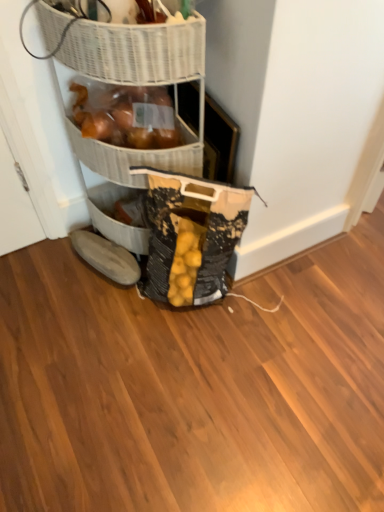
I want to click on brown suede boot at lower left, so click(x=106, y=257).

Identify the location of textured canvas bag at lower center. This screenshot has width=384, height=512. (191, 236).

Does point (92, 22) appear closer or farther from the camera than point (72, 244)?

Point (92, 22) appears to be closer to the viewer than point (72, 244).

Is white wicker basket at upper left, which is counted as the second basket, starting from the back, located outside brown suede boot at lower left?

white wicker basket at upper left, which is counted as the second basket, starting from the back, lies outside brown suede boot at lower left's area.

Is white wicker basket at upper left, which is counted as the second basket, starting from the back, to the left of brown suede boot at lower left from the viewer's perspective?

No, white wicker basket at upper left, which is counted as the second basket, starting from the back, is not to the left of brown suede boot at lower left.

Considering the relative positions of white wicker basket at upper left, which is counted as the second basket, starting from the back, and brown suede boot at lower left in the image provided, is white wicker basket at upper left, which is counted as the second basket, starting from the back, behind brown suede boot at lower left?

No.

Which object is more forward, brown suede boot at lower left or white wicker basket at upper left, marked as the first basket in a front-to-back arrangement?

white wicker basket at upper left, marked as the first basket in a front-to-back arrangement.

Does brown suede boot at lower left have a lesser height compared to white wicker basket at upper left, which is counted as the second basket, starting from the back?

Correct, brown suede boot at lower left is not as tall as white wicker basket at upper left, which is counted as the second basket, starting from the back.

Considering the positions of points (83, 234) and (143, 57), is point (83, 234) farther from camera compared to point (143, 57)?

Yes, it is behind point (143, 57).

From the image's perspective, is brown suede boot at lower left beneath textured canvas bag at lower center?

Yes.

There is a brown suede boot at lower left. Where is `material above it (from a real-world perspective)`? The image size is (384, 512). material above it (from a real-world perspective) is located at coordinates (191, 236).

Can we say brown suede boot at lower left lies outside textured canvas bag at lower center?

Yes, brown suede boot at lower left is outside of textured canvas bag at lower center.

Is textured canvas bag at lower center spatially inside white wicker basket at upper left, which is counted as the second basket, starting from the back, or outside of it?

textured canvas bag at lower center lies outside white wicker basket at upper left, which is counted as the second basket, starting from the back.

Is the position of textured canvas bag at lower center more distant than that of white wicker basket at upper left, which is counted as the second basket, starting from the back?

Yes, textured canvas bag at lower center is further from the viewer.

From the image's perspective, is textured canvas bag at lower center positioned above or below white wicker basket at upper left, marked as the first basket in a front-to-back arrangement?

textured canvas bag at lower center is below white wicker basket at upper left, marked as the first basket in a front-to-back arrangement.

Is textured canvas bag at lower center wider than white wicker basket at upper left, marked as the first basket in a front-to-back arrangement?

No.

Considering the sizes of textured canvas bag at lower center and brown suede boot at lower left in the image, is textured canvas bag at lower center wider or thinner than brown suede boot at lower left?

textured canvas bag at lower center is wider than brown suede boot at lower left.

From a real-world perspective, is textured canvas bag at lower center below brown suede boot at lower left?

No, from a real-world perspective, textured canvas bag at lower center is not below brown suede boot at lower left.

Which is in front, point (175, 191) or point (107, 247)?

The point (175, 191) is in front.

Are textured canvas bag at lower center and brown suede boot at lower left making contact?

There is a gap between textured canvas bag at lower center and brown suede boot at lower left.

Is textured canvas bag at lower center placed right next to woven brown basket at upper center, which ranks as the 2th basket in front-to-back order?

textured canvas bag at lower center and woven brown basket at upper center, which ranks as the 2th basket in front-to-back order, are not in contact.

Which is more to the right, textured canvas bag at lower center or woven brown basket at upper center, acting as the first basket starting from the back?

Positioned to the right is textured canvas bag at lower center.

Is textured canvas bag at lower center facing towards woven brown basket at upper center, acting as the first basket starting from the back?

No.

From the picture: Can you confirm if brown suede boot at lower left is shorter than woven brown basket at upper center, which ranks as the 2th basket in front-to-back order?

Indeed, brown suede boot at lower left has a lesser height compared to woven brown basket at upper center, which ranks as the 2th basket in front-to-back order.

From the image's perspective, which is below, brown suede boot at lower left or woven brown basket at upper center, which ranks as the 2th basket in front-to-back order?

brown suede boot at lower left.

Which object is thinner, brown suede boot at lower left or woven brown basket at upper center, which ranks as the 2th basket in front-to-back order?

brown suede boot at lower left is thinner.

Is brown suede boot at lower left aimed at woven brown basket at upper center, acting as the first basket starting from the back?

No, brown suede boot at lower left is not turned towards woven brown basket at upper center, acting as the first basket starting from the back.

Where is `footwear on the left of the white wicker basket at upper left, marked as the first basket in a front-to-back arrangement`? footwear on the left of the white wicker basket at upper left, marked as the first basket in a front-to-back arrangement is located at coordinates (106, 257).

Where is `footwear located behind the white wicker basket at upper left, marked as the first basket in a front-to-back arrangement`? Image resolution: width=384 pixels, height=512 pixels. footwear located behind the white wicker basket at upper left, marked as the first basket in a front-to-back arrangement is located at coordinates (106, 257).

Which object lies further to the anchor point textured canvas bag at lower center, brown suede boot at lower left or woven brown basket at upper center, acting as the first basket starting from the back?

brown suede boot at lower left is positioned further to the anchor textured canvas bag at lower center.

From the image, which object appears to be farther from brown suede boot at lower left, white wicker basket at upper left, marked as the first basket in a front-to-back arrangement, or woven brown basket at upper center, which ranks as the 2th basket in front-to-back order?

white wicker basket at upper left, marked as the first basket in a front-to-back arrangement, is further to brown suede boot at lower left.

From the picture: Based on their spatial positions, is textured canvas bag at lower center or white wicker basket at upper left, which is counted as the second basket, starting from the back, further from woven brown basket at upper center, acting as the first basket starting from the back?

white wicker basket at upper left, which is counted as the second basket, starting from the back.

Based on their spatial positions, is woven brown basket at upper center, which ranks as the 2th basket in front-to-back order, or brown suede boot at lower left closer to textured canvas bag at lower center?

Among the two, woven brown basket at upper center, which ranks as the 2th basket in front-to-back order, is located nearer to textured canvas bag at lower center.

Based on their spatial positions, is woven brown basket at upper center, which ranks as the 2th basket in front-to-back order, or white wicker basket at upper left, marked as the first basket in a front-to-back arrangement, closer to textured canvas bag at lower center?

woven brown basket at upper center, which ranks as the 2th basket in front-to-back order, is closer to textured canvas bag at lower center.

Which object lies further to the anchor point textured canvas bag at lower center, white wicker basket at upper left, which is counted as the second basket, starting from the back, or woven brown basket at upper center, which ranks as the 2th basket in front-to-back order?

The object further to textured canvas bag at lower center is white wicker basket at upper left, which is counted as the second basket, starting from the back.

From the image, which object appears to be farther from white wicker basket at upper left, marked as the first basket in a front-to-back arrangement, textured canvas bag at lower center or woven brown basket at upper center, acting as the first basket starting from the back?

The object further to white wicker basket at upper left, marked as the first basket in a front-to-back arrangement, is textured canvas bag at lower center.

Based on their spatial positions, is woven brown basket at upper center, acting as the first basket starting from the back, or textured canvas bag at lower center further from white wicker basket at upper left, which is counted as the second basket, starting from the back?

The object further to white wicker basket at upper left, which is counted as the second basket, starting from the back, is textured canvas bag at lower center.

Find the location of a particular element. The image size is (384, 512). material between woven brown basket at upper center, acting as the first basket starting from the back, and brown suede boot at lower left vertically is located at coordinates (191, 236).

This screenshot has width=384, height=512. I want to click on basket between white wicker basket at upper left, marked as the first basket in a front-to-back arrangement, and textured canvas bag at lower center, in the vertical direction, so click(x=136, y=157).

At what (x,y) coordinates should I click in order to perform the action: click on material that lies between white wicker basket at upper left, which is counted as the second basket, starting from the back, and brown suede boot at lower left from top to bottom. Please return your answer as a coordinate pair (x, y). Looking at the image, I should click on (191, 236).

I want to click on basket between white wicker basket at upper left, marked as the first basket in a front-to-back arrangement, and brown suede boot at lower left from top to bottom, so click(136, 157).